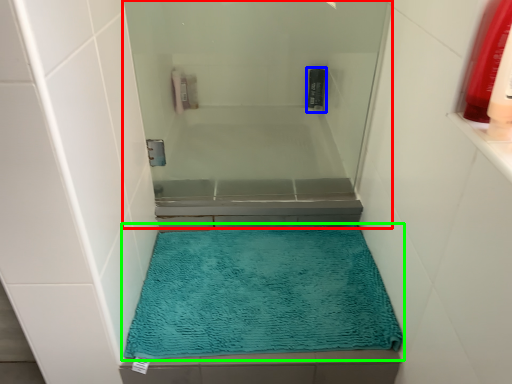
Question: Which is nearer to the screen door (highlighted by a red box)? mouthwash (highlighted by a blue box) or bath mat (highlighted by a green box).

Choices:
 (A) mouthwash
 (B) bath mat

Answer: (B)